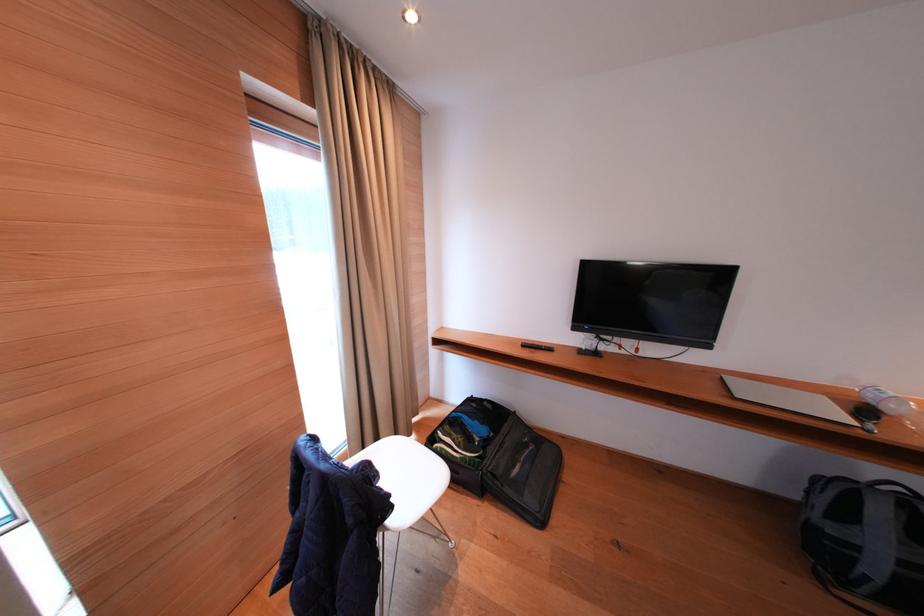
The width and height of the screenshot is (924, 616). What do you see at coordinates (407, 469) in the screenshot?
I see `the white chair sitting surface` at bounding box center [407, 469].